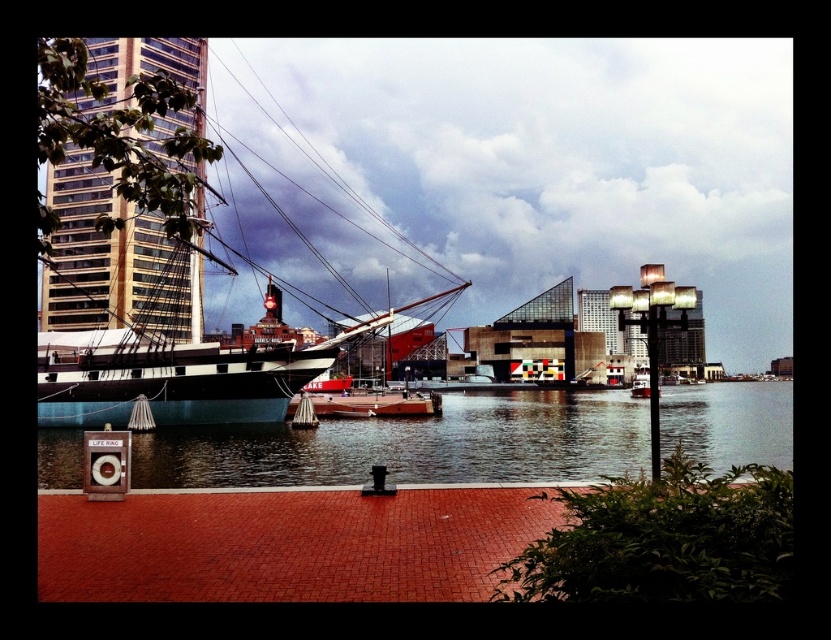
In the scene shown: Between brick at lower center and clear water at center, which one appears on the right side from the viewer's perspective?

clear water at center

Does brick at lower center appear on the right side of clear water at center?

No, brick at lower center is not to the right of clear water at center.

Which is in front, point (297, 525) or point (219, 483)?

Point (297, 525) is in front.

Locate an element on the screen. This screenshot has height=640, width=831. brick at lower center is located at coordinates (288, 544).

Can you confirm if black polished wood ship at left is thinner than brick at lower center?

No, black polished wood ship at left is not thinner than brick at lower center.

Is point (239, 381) less distant than point (91, 592)?

No, it is not.

Where is `black polished wood ship at left`? The height and width of the screenshot is (640, 831). black polished wood ship at left is located at coordinates (144, 314).

Can you confirm if black polished wood ship at left is positioned above clear water at center?

Yes, black polished wood ship at left is above clear water at center.

Can you confirm if black polished wood ship at left is taller than clear water at center?

Yes.

Is point (53, 289) positioned before point (632, 417)?

No.

I want to click on black polished wood ship at left, so click(x=144, y=314).